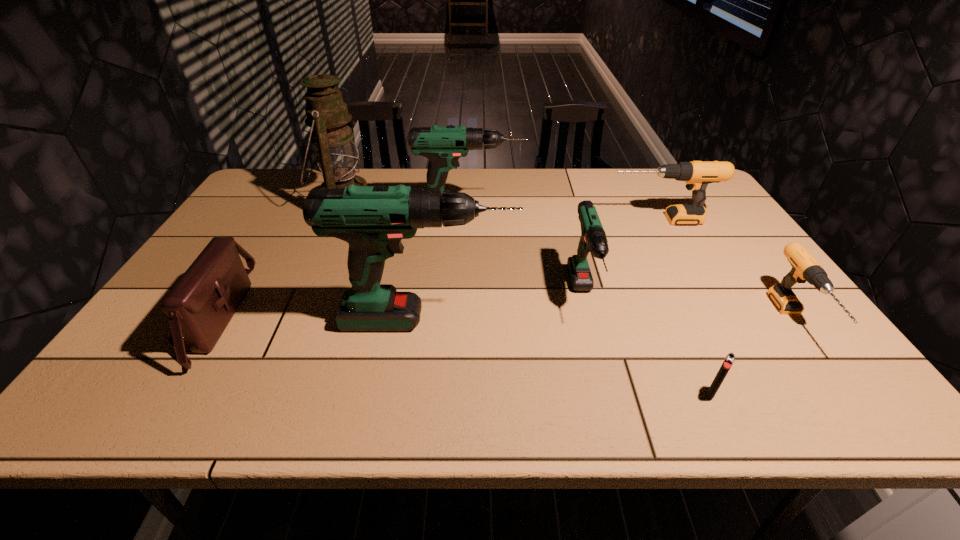
The height and width of the screenshot is (540, 960). Identify the location of free space between the tallest drill and the leftmost object. (321, 319).

The height and width of the screenshot is (540, 960). What are the coordinates of `free space between the fifth object from left to right and the nearest object` in the screenshot? It's located at (647, 345).

What are the coordinates of `free area in between the leftmost object and the farther black drill` in the screenshot? It's located at (437, 269).

Find the location of a particular element. free space between the farther black drill and the nearer black drill is located at coordinates (728, 270).

What are the coordinates of `free spot between the bigger black drill and the nearer black drill` in the screenshot? It's located at (728, 270).

This screenshot has height=540, width=960. Find the location of `unoccupied area between the nearer black drill and the farther black drill`. unoccupied area between the nearer black drill and the farther black drill is located at coordinates (728, 270).

I want to click on vacant area that lies between the rightmost green drill and the sixth shortest object, so click(x=526, y=255).

Where is `free spot between the igniter and the leftmost object`? This screenshot has height=540, width=960. free spot between the igniter and the leftmost object is located at coordinates (463, 356).

The width and height of the screenshot is (960, 540). Identify the location of free area in between the smallest green drill and the tallest drill. (505, 308).

Where is `object that is the third nearest to the second smallest green drill`? The height and width of the screenshot is (540, 960). object that is the third nearest to the second smallest green drill is located at coordinates (697, 174).